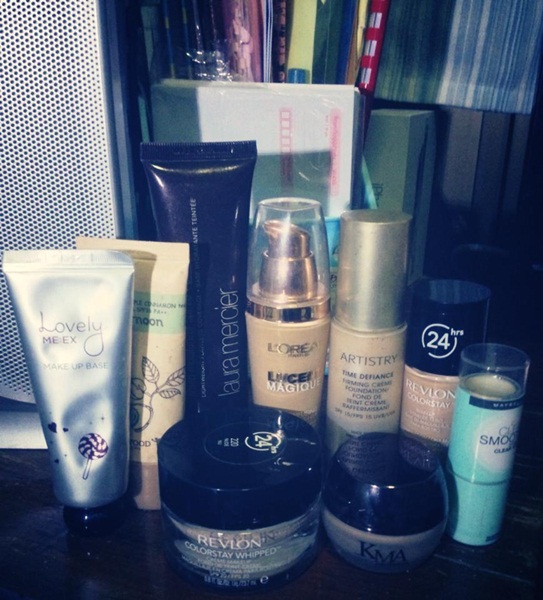
At what (x,y) coordinates should I click in order to perform the action: click on makeup. Please return your answer as a coordinate pair (x, y). This screenshot has height=600, width=543. Looking at the image, I should click on (233, 552).